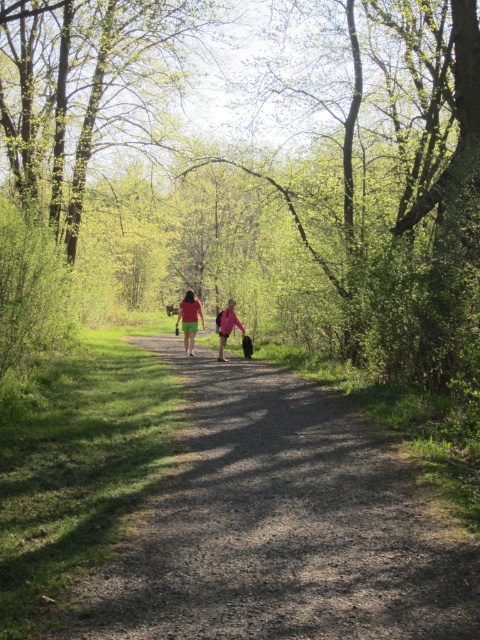
Question: Which object appears farthest from the camera in this image?

Choices:
 (A) matte pink jacket at center
 (B) green fabric shirt at center
 (C) dirt path at center
 (D) green leafy tree at center

Answer: (B)

Question: Which object is positioned farthest from the dirt path at center?

Choices:
 (A) matte pink jacket at center
 (B) green fabric shirt at center

Answer: (B)

Question: Can you confirm if dirt path at center is smaller than green fabric shirt at center?

Choices:
 (A) yes
 (B) no

Answer: (A)

Question: Based on their relative distances, which object is farther from the green fabric shirt at center?

Choices:
 (A) green leafy tree at center
 (B) dirt path at center

Answer: (A)

Question: Does dirt path at center have a larger size compared to green fabric shirt at center?

Choices:
 (A) yes
 (B) no

Answer: (B)

Question: Can you confirm if green leafy tree at center is positioned to the left of matte pink jacket at center?

Choices:
 (A) yes
 (B) no

Answer: (A)